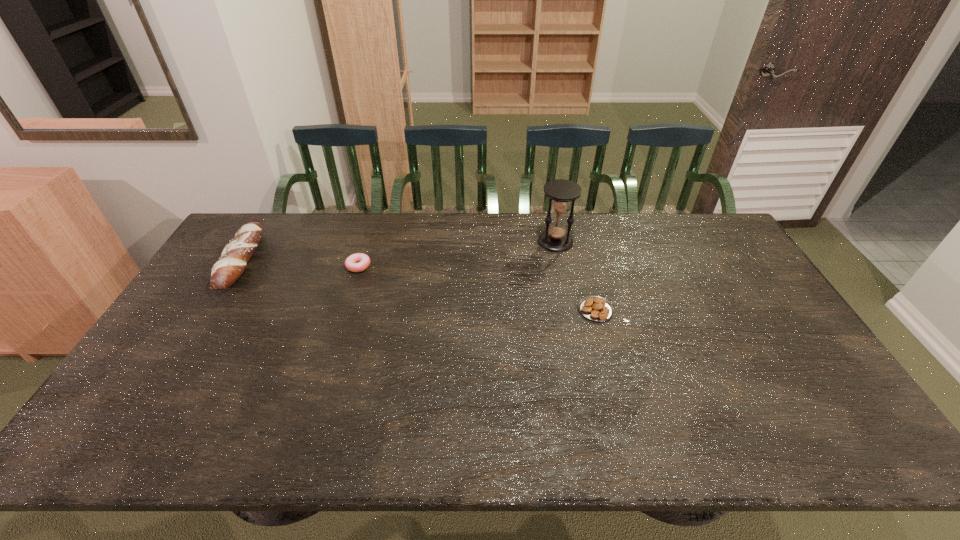
Locate an element on the screen. This screenshot has height=540, width=960. object that is the third closest to the pastry is located at coordinates (225, 272).

Locate which object ranks third in proximity to the tallest object. Please provide its 2D coordinates. Your answer should be formatted as a tuple, i.e. [(x, y)], where the tuple contains the x and y coordinates of a point satisfying the conditions above.

[(225, 272)]

Locate an element on the screen. Image resolution: width=960 pixels, height=540 pixels. free spot that satisfies the following two spatial constraints: 1. on the front side of the hourglass; 2. on the left side of the pastry is located at coordinates (569, 310).